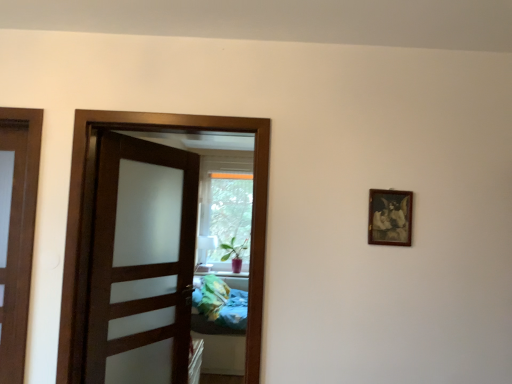
Question: Are green matte plant at center and wooden picture frame at upper right located far from each other?

Choices:
 (A) no
 (B) yes

Answer: (B)

Question: From the image's perspective, does green matte plant at center appear higher than wooden picture frame at upper right?

Choices:
 (A) yes
 (B) no

Answer: (B)

Question: Can you confirm if green matte plant at center is thinner than wooden picture frame at upper right?

Choices:
 (A) no
 (B) yes

Answer: (A)

Question: Can you confirm if green matte plant at center is positioned to the left of wooden picture frame at upper right?

Choices:
 (A) no
 (B) yes

Answer: (B)

Question: From a real-world perspective, is green matte plant at center located higher than wooden picture frame at upper right?

Choices:
 (A) no
 (B) yes

Answer: (A)

Question: Is wooden picture frame at upper right wider or thinner than green matte plant at center?

Choices:
 (A) thin
 (B) wide

Answer: (A)

Question: Relative to green matte plant at center, is wooden picture frame at upper right in front or behind?

Choices:
 (A) front
 (B) behind

Answer: (A)

Question: Considering the positions of point (378, 198) and point (233, 244), is point (378, 198) closer or farther from the camera than point (233, 244)?

Choices:
 (A) farther
 (B) closer

Answer: (B)

Question: Visually, is wooden picture frame at upper right positioned to the left or to the right of green matte plant at center?

Choices:
 (A) left
 (B) right

Answer: (B)

Question: Looking at their shapes, would you say green matte plant at center is wider or thinner than brown wooden door at center?

Choices:
 (A) wide
 (B) thin

Answer: (A)

Question: From a real-world perspective, is green matte plant at center physically located above or below brown wooden door at center?

Choices:
 (A) below
 (B) above

Answer: (A)

Question: Is green matte plant at center to the left or to the right of brown wooden door at center in the image?

Choices:
 (A) right
 (B) left

Answer: (A)

Question: Do you think green matte plant at center is within brown wooden door at center, or outside of it?

Choices:
 (A) inside
 (B) outside

Answer: (B)

Question: Is point (241, 253) positioned closer to the camera than point (399, 236)?

Choices:
 (A) farther
 (B) closer

Answer: (A)

Question: Is green matte plant at center taller or shorter than wooden picture frame at upper right?

Choices:
 (A) short
 (B) tall

Answer: (B)